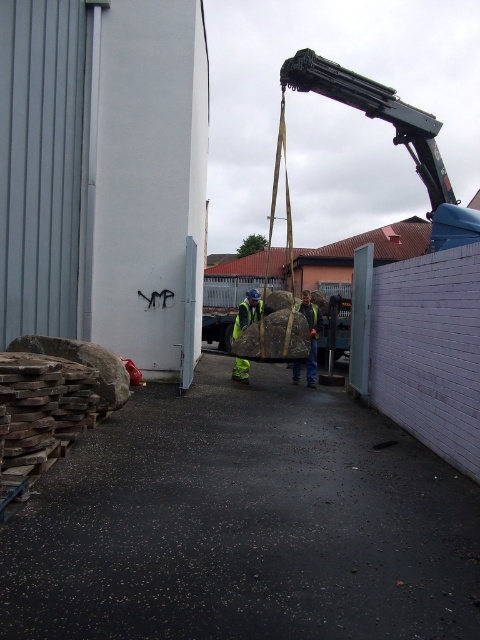
Question: Among these objects, which one is farthest from the camera?

Choices:
 (A) smooth concrete alley at center
 (B) reflective yellow safety vest at center

Answer: (B)

Question: Is smooth concrete alley at center above reflective yellow safety vest at center?

Choices:
 (A) yes
 (B) no

Answer: (B)

Question: Which object appears closest to the camera in this image?

Choices:
 (A) smooth concrete alley at center
 (B) reflective yellow safety vest at center

Answer: (A)

Question: Can you confirm if smooth concrete alley at center is positioned above reflective yellow safety vest at center?

Choices:
 (A) no
 (B) yes

Answer: (A)

Question: Which point is closer to the camera?

Choices:
 (A) smooth concrete alley at center
 (B) reflective yellow safety vest at center

Answer: (A)

Question: Can you confirm if smooth concrete alley at center is positioned to the left of reflective yellow safety vest at center?

Choices:
 (A) no
 (B) yes

Answer: (B)